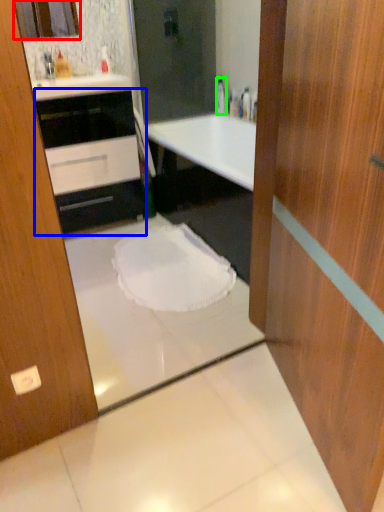
Question: Which object is positioned closest to mirror (highlighted by a red box)? Select from cabinetry (highlighted by a blue box) and bottle (highlighted by a green box).

Choices:
 (A) cabinetry
 (B) bottle

Answer: (A)